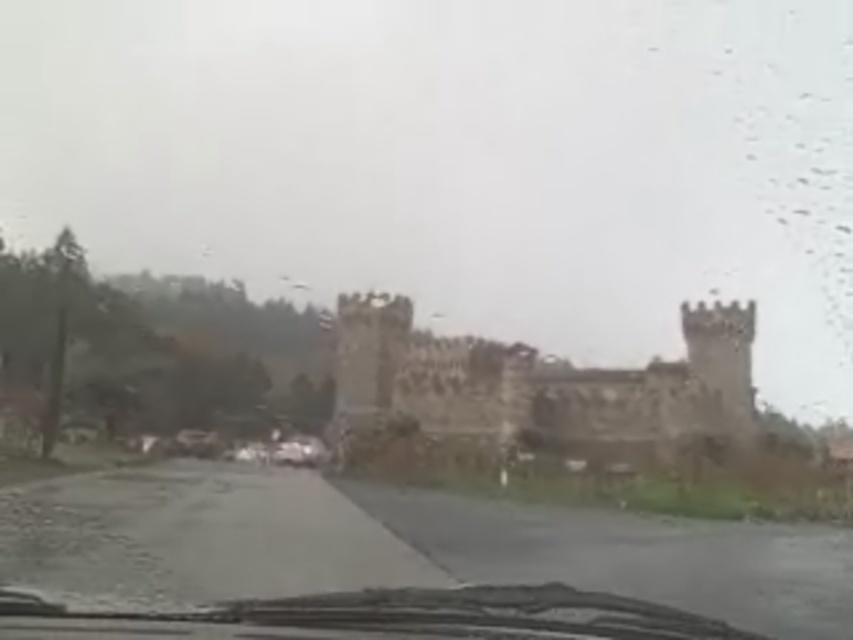
You are driving a car with a 1.8 meter wide windshield. You see the brown stone castle at center and the transparent glass windshield at center. Can the entire castle be seen through the windshield without moving the car?

The brown stone castle at center might be wider than transparent glass windshield at center. Since the windshield is only 1.8 meters wide, it is possible that the castle cannot be fully viewed through it if its width exceeds the windshield.

In the scene shown: You are a driver in a car and want to know if you can safely pass through the area between the transparent glass windshield at center and the metallic silver car at center. The minimum safe distance required for passing is 180 meters. Can you safely pass?

The transparent glass windshield at center and the metallic silver car at center are 174.82 meters apart. Since the required safe distance is 180 meters, you cannot safely pass through the area between them.